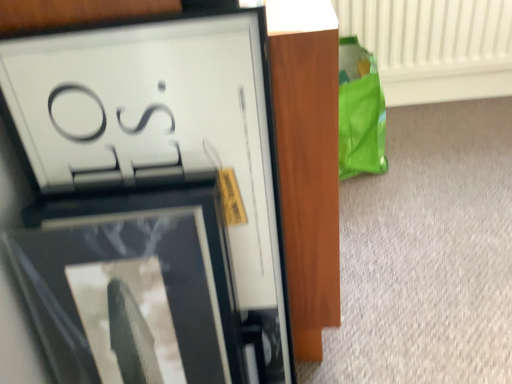
The height and width of the screenshot is (384, 512). Find the location of `matte black picture frame at upper left, the 2th picture frame ordered from the bottom`. matte black picture frame at upper left, the 2th picture frame ordered from the bottom is located at coordinates (150, 200).

What do you see at coordinates (430, 35) in the screenshot?
I see `white textured radiator at upper right` at bounding box center [430, 35].

You are a GUI agent. You are given a task and a screenshot of the screen. Output one action in this format:
    pyautogui.click(x=<x>, y=<y>)
    Task: Click on the matte black picture frame at upper left, the 2th picture frame when ordered from top to bottom
    The height and width of the screenshot is (384, 512).
    Given the screenshot: What is the action you would take?
    pyautogui.click(x=131, y=288)

Image resolution: width=512 pixels, height=384 pixels. Find the location of `matte black picture frame at upper left, the 1th picture frame viewed from the top`. matte black picture frame at upper left, the 1th picture frame viewed from the top is located at coordinates (150, 200).

Is matte black picture frame at upper left, the 1th picture frame viewed from the top, situated inside matte black picture frame at upper left, the 2th picture frame when ordered from top to bottom, or outside?

matte black picture frame at upper left, the 1th picture frame viewed from the top, cannot be found inside matte black picture frame at upper left, the 2th picture frame when ordered from top to bottom.

Which object is positioned more to the right, matte black picture frame at upper left, the 1th picture frame viewed from the top, or matte black picture frame at upper left, the 2th picture frame when ordered from top to bottom?

Positioned to the right is matte black picture frame at upper left, the 1th picture frame viewed from the top.

Considering the relative positions of matte black picture frame at upper left, the 2th picture frame ordered from the bottom, and matte black picture frame at upper left, the 1th picture frame when ordered from bottom to top, in the image provided, is matte black picture frame at upper left, the 2th picture frame ordered from the bottom, behind matte black picture frame at upper left, the 1th picture frame when ordered from bottom to top,?

Yes, it is behind matte black picture frame at upper left, the 1th picture frame when ordered from bottom to top.

From the picture: From the image's perspective, is white textured radiator at upper right above matte black picture frame at upper left, the 1th picture frame when ordered from bottom to top?

Yes, from the image's perspective, white textured radiator at upper right is over matte black picture frame at upper left, the 1th picture frame when ordered from bottom to top.

Is white textured radiator at upper right not inside matte black picture frame at upper left, the 2th picture frame when ordered from top to bottom?

white textured radiator at upper right is positioned outside matte black picture frame at upper left, the 2th picture frame when ordered from top to bottom.

From the picture: Are white textured radiator at upper right and matte black picture frame at upper left, the 2th picture frame when ordered from top to bottom, making contact?

No, white textured radiator at upper right is not making contact with matte black picture frame at upper left, the 2th picture frame when ordered from top to bottom.

Considering the sizes of white textured radiator at upper right and matte black picture frame at upper left, the 2th picture frame when ordered from top to bottom, in the image, is white textured radiator at upper right taller or shorter than matte black picture frame at upper left, the 2th picture frame when ordered from top to bottom,?

Clearly, white textured radiator at upper right is shorter compared to matte black picture frame at upper left, the 2th picture frame when ordered from top to bottom.

Is the surface of matte black picture frame at upper left, the 2th picture frame when ordered from top to bottom, in direct contact with white textured radiator at upper right?

They are not placed beside each other.

Between matte black picture frame at upper left, the 1th picture frame when ordered from bottom to top, and white textured radiator at upper right, which one has smaller size?

Smaller between the two is matte black picture frame at upper left, the 1th picture frame when ordered from bottom to top.

In order to click on radiator beneath the matte black picture frame at upper left, the 1th picture frame when ordered from bottom to top (from a real-world perspective) in this screenshot , I will do `click(430, 35)`.

Would you say matte black picture frame at upper left, the 1th picture frame when ordered from bottom to top, is to the left or to the right of white textured radiator at upper right in the picture?

Clearly, matte black picture frame at upper left, the 1th picture frame when ordered from bottom to top, is on the left of white textured radiator at upper right in the image.

Does point (399, 33) come farther from viewer compared to point (261, 238)?

Yes, point (399, 33) is farther from viewer.

From the image's perspective, is white textured radiator at upper right on top of matte black picture frame at upper left, the 1th picture frame viewed from the top?

Yes, from the image's perspective, white textured radiator at upper right is above matte black picture frame at upper left, the 1th picture frame viewed from the top.

Is white textured radiator at upper right wider or thinner than matte black picture frame at upper left, the 1th picture frame viewed from the top?

Clearly, white textured radiator at upper right has more width compared to matte black picture frame at upper left, the 1th picture frame viewed from the top.

Can you see matte black picture frame at upper left, the 1th picture frame viewed from the top, touching white textured radiator at upper right?

No.

From a real-world perspective, between matte black picture frame at upper left, the 1th picture frame viewed from the top, and white textured radiator at upper right, who is vertically higher?

In real-world perspective, matte black picture frame at upper left, the 1th picture frame viewed from the top, is above.

How far apart are matte black picture frame at upper left, the 1th picture frame viewed from the top, and white textured radiator at upper right?

A distance of 1.34 meters exists between matte black picture frame at upper left, the 1th picture frame viewed from the top, and white textured radiator at upper right.

Does matte black picture frame at upper left, the 1th picture frame viewed from the top, have a smaller size compared to white textured radiator at upper right?

Indeed, matte black picture frame at upper left, the 1th picture frame viewed from the top, has a smaller size compared to white textured radiator at upper right.

Are matte black picture frame at upper left, the 1th picture frame when ordered from bottom to top, and matte black picture frame at upper left, the 1th picture frame viewed from the top, beside each other?

Yes, matte black picture frame at upper left, the 1th picture frame when ordered from bottom to top, and matte black picture frame at upper left, the 1th picture frame viewed from the top, clearly make contact.

Is matte black picture frame at upper left, the 2th picture frame when ordered from top to bottom, shorter than matte black picture frame at upper left, the 1th picture frame viewed from the top?

Yes.

Considering the relative positions of matte black picture frame at upper left, the 1th picture frame when ordered from bottom to top, and matte black picture frame at upper left, the 1th picture frame viewed from the top, in the image provided, is matte black picture frame at upper left, the 1th picture frame when ordered from bottom to top, to the left of matte black picture frame at upper left, the 1th picture frame viewed from the top, from the viewer's perspective?

Indeed, matte black picture frame at upper left, the 1th picture frame when ordered from bottom to top, is positioned on the left side of matte black picture frame at upper left, the 1th picture frame viewed from the top.

Is matte black picture frame at upper left, the 2th picture frame when ordered from top to bottom, not inside matte black picture frame at upper left, the 2th picture frame ordered from the bottom?

Absolutely, matte black picture frame at upper left, the 2th picture frame when ordered from top to bottom, is external to matte black picture frame at upper left, the 2th picture frame ordered from the bottom.

Locate an element on the screen. The width and height of the screenshot is (512, 384). picture frame below the matte black picture frame at upper left, the 1th picture frame viewed from the top (from a real-world perspective) is located at coordinates (131, 288).

This screenshot has width=512, height=384. In order to click on the 2nd picture frame positioned below the white textured radiator at upper right (from the image's perspective) in this screenshot , I will do `click(131, 288)`.

Considering their positions, is white textured radiator at upper right positioned closer to matte black picture frame at upper left, the 1th picture frame when ordered from bottom to top, than matte black picture frame at upper left, the 2th picture frame ordered from the bottom?

Among the two, matte black picture frame at upper left, the 2th picture frame ordered from the bottom, is located nearer to matte black picture frame at upper left, the 1th picture frame when ordered from bottom to top.

Looking at the image, which one is located closer to matte black picture frame at upper left, the 2th picture frame ordered from the bottom, matte black picture frame at upper left, the 1th picture frame when ordered from bottom to top, or white textured radiator at upper right?

Among the two, matte black picture frame at upper left, the 1th picture frame when ordered from bottom to top, is located nearer to matte black picture frame at upper left, the 2th picture frame ordered from the bottom.

When comparing their distances from matte black picture frame at upper left, the 2th picture frame when ordered from top to bottom, does matte black picture frame at upper left, the 1th picture frame viewed from the top, or white textured radiator at upper right seem closer?

matte black picture frame at upper left, the 1th picture frame viewed from the top.

When comparing their distances from white textured radiator at upper right, does matte black picture frame at upper left, the 2th picture frame ordered from the bottom, or matte black picture frame at upper left, the 1th picture frame when ordered from bottom to top, seem further?

matte black picture frame at upper left, the 1th picture frame when ordered from bottom to top, is positioned further to the anchor white textured radiator at upper right.

From the image, which object appears to be farther from white textured radiator at upper right, matte black picture frame at upper left, the 2th picture frame when ordered from top to bottom, or matte black picture frame at upper left, the 1th picture frame viewed from the top?

matte black picture frame at upper left, the 2th picture frame when ordered from top to bottom.

Considering their positions, is white textured radiator at upper right positioned closer to matte black picture frame at upper left, the 1th picture frame viewed from the top, than matte black picture frame at upper left, the 2th picture frame when ordered from top to bottom?

The object closer to matte black picture frame at upper left, the 1th picture frame viewed from the top, is matte black picture frame at upper left, the 2th picture frame when ordered from top to bottom.

Image resolution: width=512 pixels, height=384 pixels. I want to click on picture frame between matte black picture frame at upper left, the 2th picture frame when ordered from top to bottom, and white textured radiator at upper right, along the z-axis, so click(150, 200).